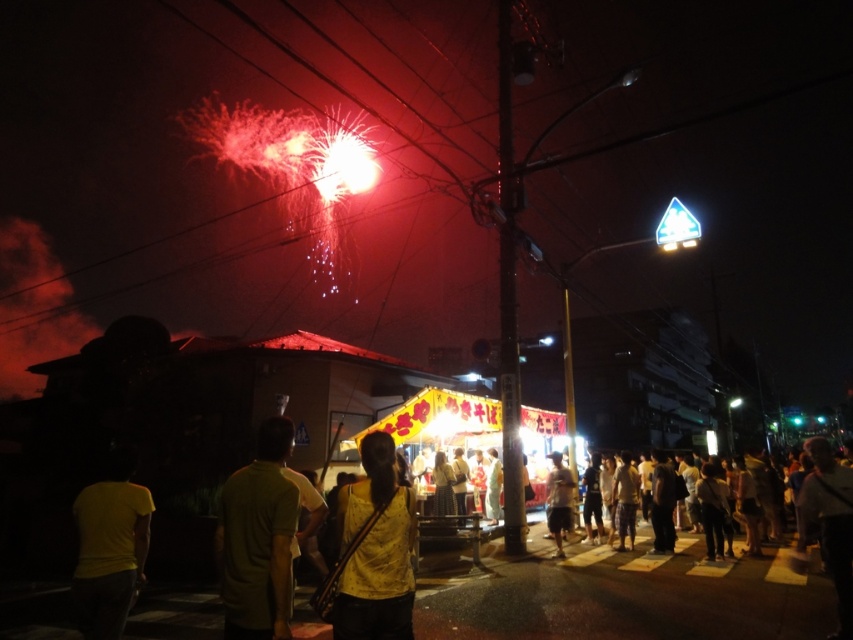
You are a photographer aiming to capture a person wearing the yellow matte shirt at center and light brown fabric pants at center. Since you want to ensure both clothing items are clearly visible, which clothing item should you focus on first to avoid blurring due to their height difference?

The yellow matte shirt at center has a lesser height compared to light brown fabric pants at center. Therefore, you should focus on the yellow matte shirt at center first to ensure it is in focus before the pants, as it is shorter and might be closer to the camera.